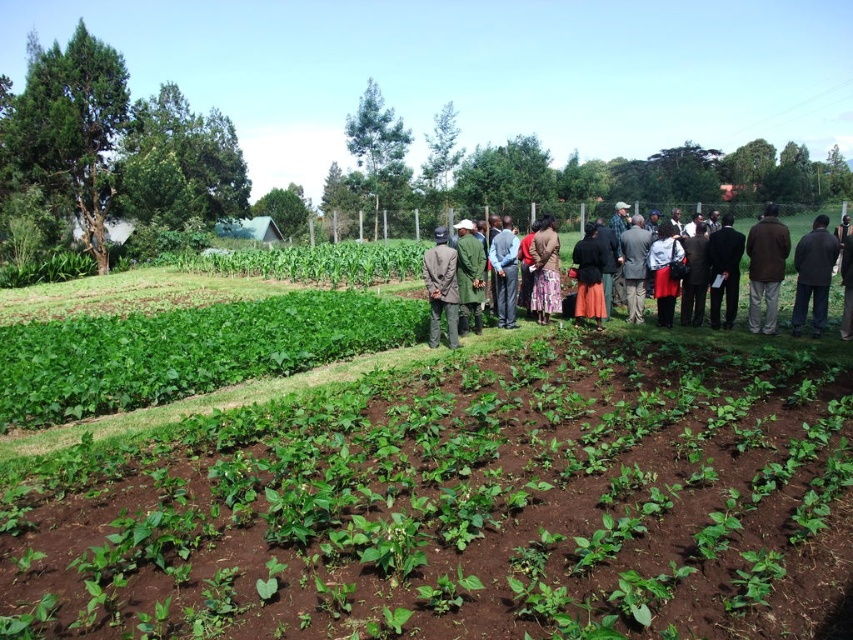
Question: Based on their relative distances, which object is farther from the green leafy plants at center?

Choices:
 (A) dark gray fabric jacket at center
 (B) black suit at center
 (C) dark brown coat at center
 (D) dark brown coat at right

Answer: (C)

Question: Considering the real-world distances, which object is farthest from the matte black dress at center?

Choices:
 (A) brown wool coat at right
 (B) green matte coat at center
 (C) green leafy plants at center
 (D) dark brown coat at right

Answer: (C)

Question: Is brown wool coat at right closer to camera compared to green matte coat at center?

Choices:
 (A) yes
 (B) no

Answer: (A)

Question: Where is brown wool coat at right located in relation to dark gray fabric jacket at center in the image?

Choices:
 (A) right
 (B) left

Answer: (A)

Question: Can you confirm if brown wool coat at right is smaller than dark brown coat at right?

Choices:
 (A) no
 (B) yes

Answer: (A)

Question: Among these points, which one is nearest to the camera?

Choices:
 (A) (550, 250)
 (B) (590, 243)

Answer: (B)